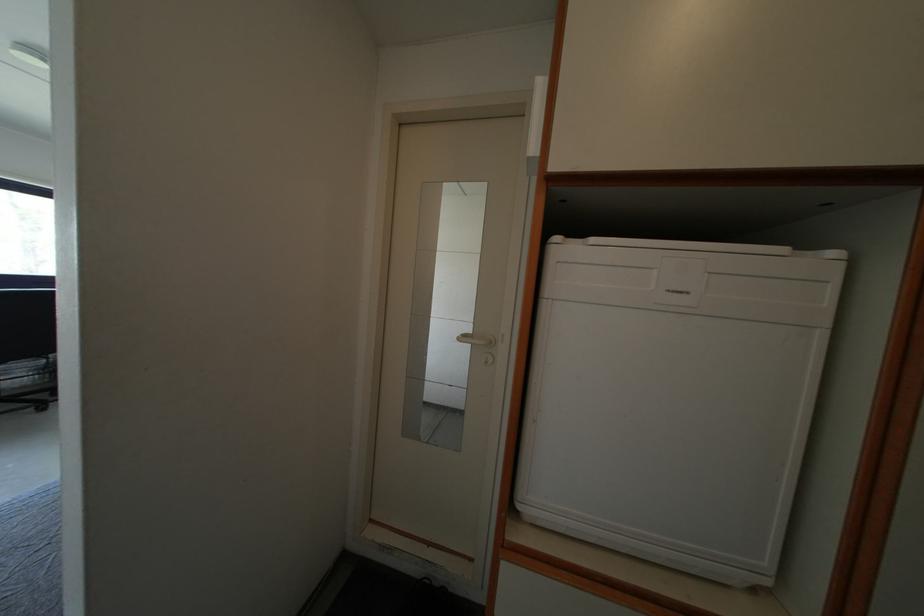
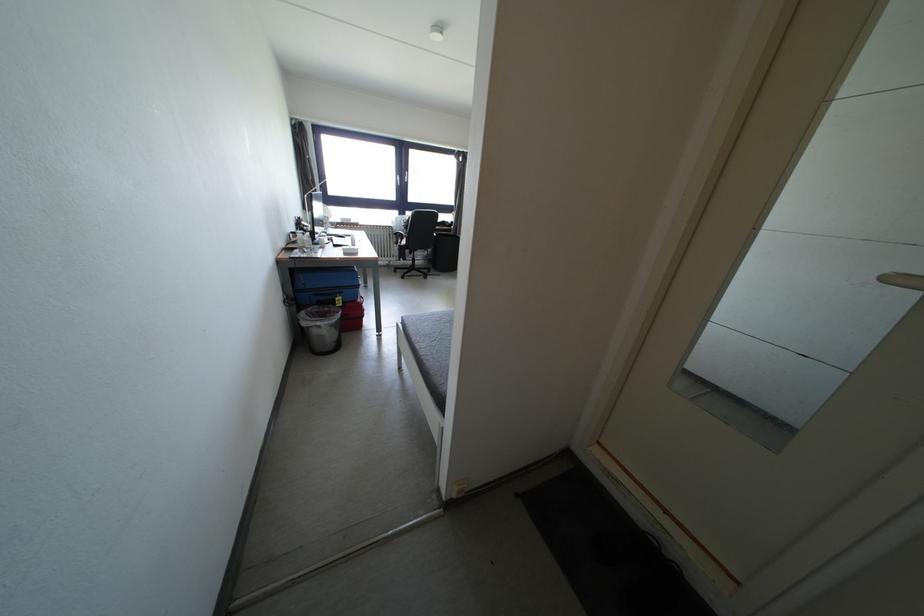
Locate, in the second image, the point that corresponds to the point at 468,342 in the first image.

(898, 284)